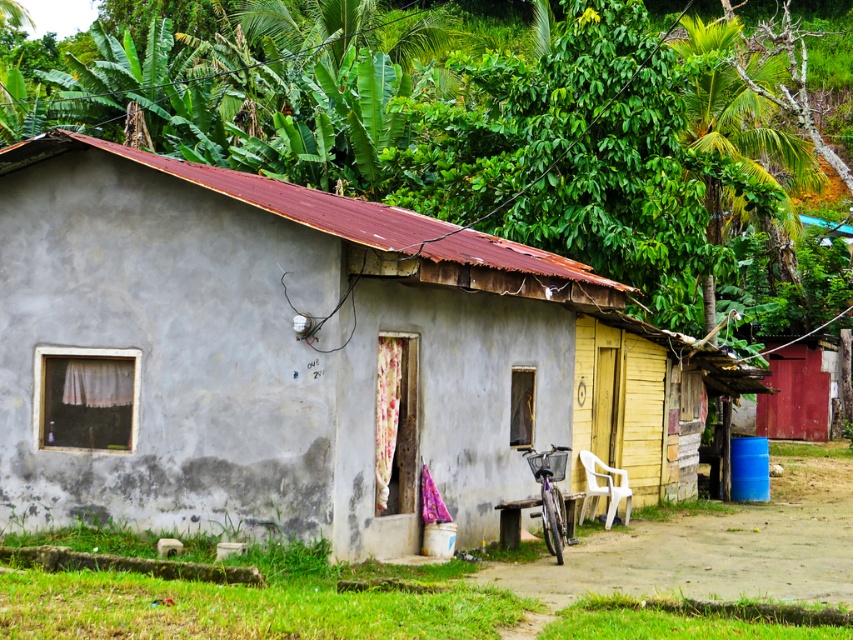
Does gray concrete hut at center have a greater width compared to green leafy vegetation at upper center?

No, gray concrete hut at center is not wider than green leafy vegetation at upper center.

Between point (656, 364) and point (474, 86), which one is positioned in front?

Point (656, 364) is in front.

The width and height of the screenshot is (853, 640). What are the coordinates of `gray concrete hut at center` in the screenshot? It's located at (300, 356).